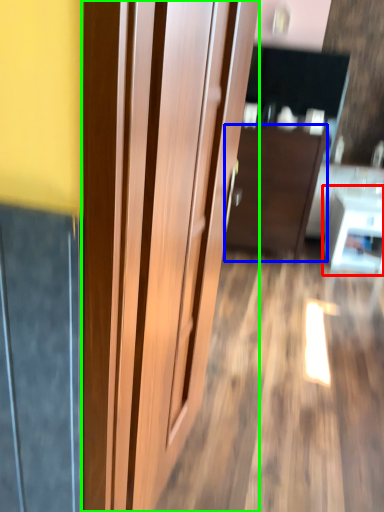
Question: Estimate the real-world distances between objects in this image. Which object is farther from table (highlighted by a red box), furniture (highlighted by a blue box) or door (highlighted by a green box)?

Choices:
 (A) furniture
 (B) door

Answer: (B)